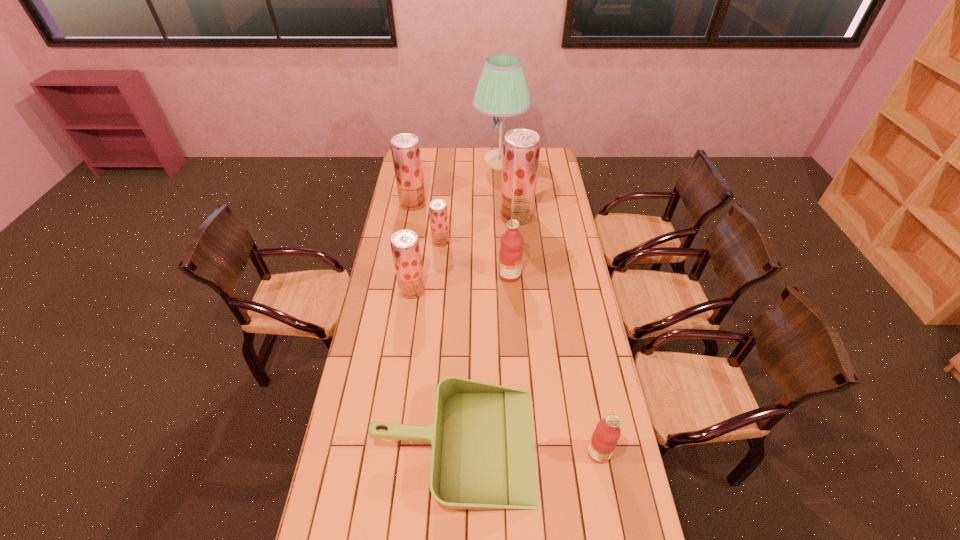
Where is `vacant space located on the label of the farther pink fruit juice`? Image resolution: width=960 pixels, height=540 pixels. vacant space located on the label of the farther pink fruit juice is located at coordinates click(410, 275).

You are a GUI agent. You are given a task and a screenshot of the screen. Output one action in this format:
    pyautogui.click(x=<x>, y=<y>)
    Task: Click on the free point located on the label of the nearest fruit juice
    
    Given the screenshot: What is the action you would take?
    pyautogui.click(x=607, y=494)

Identify the location of vacant region located on the left of the third farthest fruit juice. (412, 241).

You are a GUI agent. You are given a task and a screenshot of the screen. Output one action in this format:
    pyautogui.click(x=<x>, y=<y>)
    Task: Click on the blank space located on the scoop of the shortest object
    The height and width of the screenshot is (540, 960).
    Given the screenshot: What is the action you would take?
    pyautogui.click(x=604, y=445)

Find the location of a particular element. The width and height of the screenshot is (960, 540). object that is at the far edge is located at coordinates (502, 91).

The height and width of the screenshot is (540, 960). I want to click on dustpan that is at the left edge, so click(483, 456).

The height and width of the screenshot is (540, 960). In order to click on object that is at the right edge in this screenshot , I will do `click(605, 437)`.

Locate an element on the screen. The height and width of the screenshot is (540, 960). vacant space at the far edge of the desktop is located at coordinates (450, 163).

Where is `free space at the left edge`? free space at the left edge is located at coordinates (394, 221).

The image size is (960, 540). In order to click on vacant space at the right edge in this screenshot , I will do `click(555, 286)`.